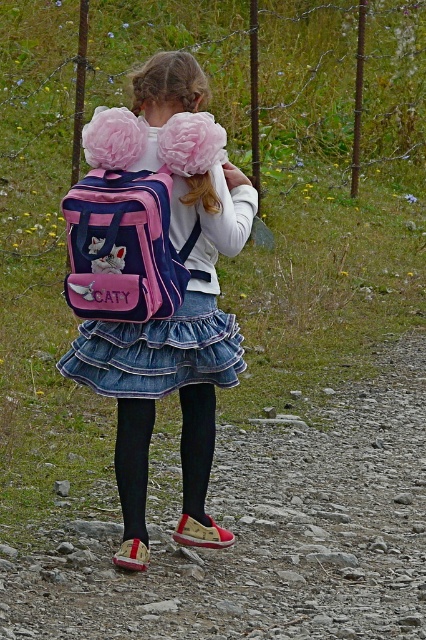
You are standing at the point labeled as point (256, 532). Looking around, you see a rough gravel path at center. What is the terrain like at your current location?

The point (256, 532) corresponds to the rough gravel path at center, so the terrain at your current location is rough gravel.

You are standing on the rough gravel path at center and looking up at the denim skirt at center. Which object is higher in elevation?

The denim skirt at center is higher in elevation than the rough gravel path at center because the denim skirt at center has a greater height.

You are standing at the camera position looking at the scene. Where is the rough gravel path at center located in terms of coordinates?

The rough gravel path at center is located at coordinates point (256, 532).